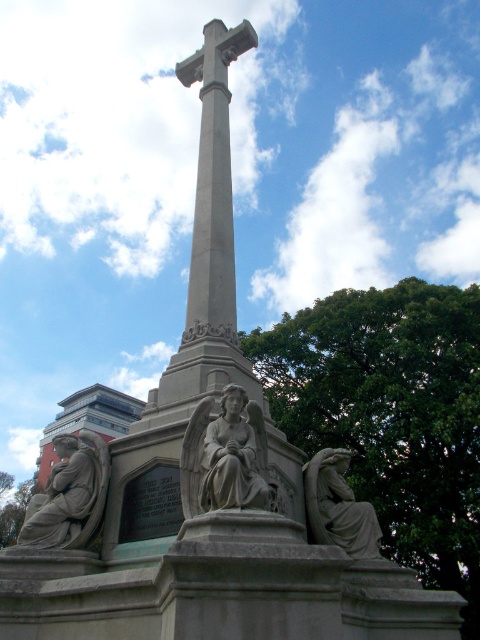
Question: Based on their relative distances, which object is farther from the gray stone cross at center?

Choices:
 (A) stone statue at lower left
 (B) gray stone angel at lower right
 (C) matte gray statue at center

Answer: (C)

Question: Does stone statue at lower left have a greater width compared to gray stone cross at center?

Choices:
 (A) no
 (B) yes

Answer: (B)

Question: Is matte gray statue at center smaller than gray stone cross at center?

Choices:
 (A) yes
 (B) no

Answer: (A)

Question: Among these objects, which one is farthest from the camera?

Choices:
 (A) stone statue at lower left
 (B) gray stone angel at lower right
 (C) matte gray statue at center
 (D) gray stone cross at center

Answer: (D)

Question: Can you confirm if stone statue at lower left is wider than gray stone angel at lower right?

Choices:
 (A) yes
 (B) no

Answer: (A)

Question: Estimate the real-world distances between objects in this image. Which object is farther from the gray stone angel at lower right?

Choices:
 (A) stone statue at lower left
 (B) gray stone cross at center
 (C) matte gray statue at center

Answer: (B)